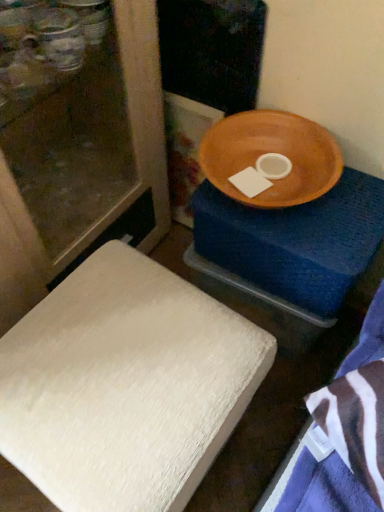
Question: Relative to wooden bowl at upper right, is white textured cushion at lower left in front or behind?

Choices:
 (A) front
 (B) behind

Answer: (A)

Question: From a real-world perspective, is white textured cushion at lower left positioned above or below wooden bowl at upper right?

Choices:
 (A) above
 (B) below

Answer: (A)

Question: In terms of size, does white textured cushion at lower left appear bigger or smaller than wooden bowl at upper right?

Choices:
 (A) big
 (B) small

Answer: (A)

Question: From the image's perspective, is wooden bowl at upper right located above or below white textured cushion at lower left?

Choices:
 (A) above
 (B) below

Answer: (A)

Question: Looking at their shapes, would you say wooden bowl at upper right is wider or thinner than white textured cushion at lower left?

Choices:
 (A) wide
 (B) thin

Answer: (B)

Question: Is wooden bowl at upper right inside the boundaries of white textured cushion at lower left, or outside?

Choices:
 (A) inside
 (B) outside

Answer: (B)

Question: In terms of size, does wooden bowl at upper right appear bigger or smaller than white textured cushion at lower left?

Choices:
 (A) small
 (B) big

Answer: (A)